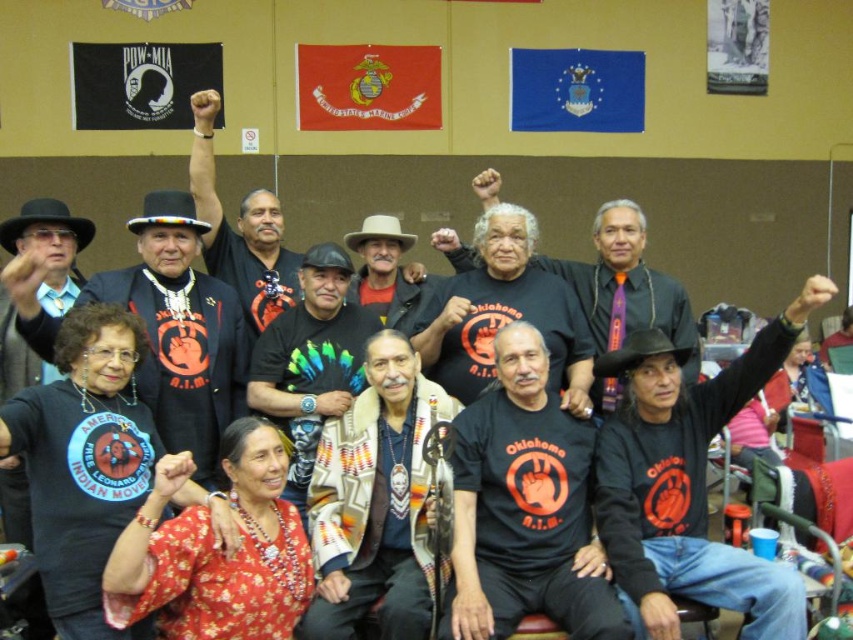
Can you confirm if black t-shirt with orange graphic at center is wider than matte black shirt at center?

Indeed, black t-shirt with orange graphic at center has a greater width compared to matte black shirt at center.

Locate an element on the screen. This screenshot has width=853, height=640. black t-shirt with orange graphic at center is located at coordinates 625,285.

Is point (668, 317) farther from viewer compared to point (233, 236)?

No, (668, 317) is in front of (233, 236).

Find the location of a particular element. black t-shirt with orange graphic at center is located at coordinates (625, 285).

Is matte black t-shirt at center positioned in front of matte black shirt at center?

Yes, matte black t-shirt at center is in front of matte black shirt at center.

Where is `matte black t-shirt at center`? This screenshot has width=853, height=640. matte black t-shirt at center is located at coordinates (181, 332).

You are a GUI agent. You are given a task and a screenshot of the screen. Output one action in this format:
    pyautogui.click(x=<x>, y=<y>)
    Task: Click on the matte black t-shirt at center
    The width and height of the screenshot is (853, 640).
    Given the screenshot: What is the action you would take?
    pyautogui.click(x=181, y=332)

Identify the location of matte black t-shirt at center. This screenshot has width=853, height=640. (181, 332).

From the picture: Is woven fabric shawl at center smaller than black leather shirt at center?

Incorrect, woven fabric shawl at center is not smaller in size than black leather shirt at center.

Which of these two, woven fabric shawl at center or black leather shirt at center, stands shorter?

With less height is woven fabric shawl at center.

The image size is (853, 640). What do you see at coordinates (376, 500) in the screenshot? I see `woven fabric shawl at center` at bounding box center [376, 500].

Identify the location of woven fabric shawl at center. (376, 500).